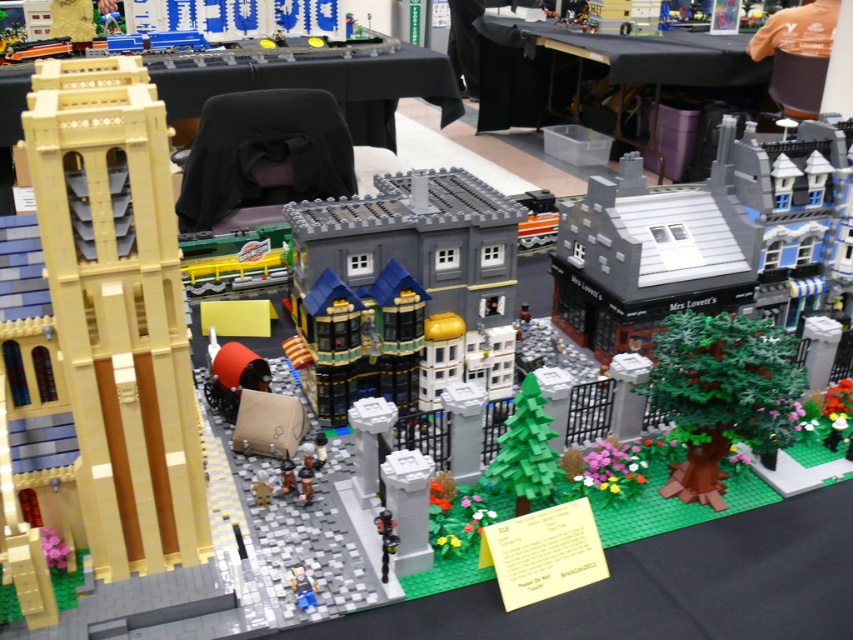
Question: Which point appears farthest from the camera in this image?

Choices:
 (A) (521, 384)
 (B) (633, 115)

Answer: (B)

Question: Which point is closer to the camera?

Choices:
 (A) pyautogui.click(x=553, y=458)
 (B) pyautogui.click(x=587, y=122)

Answer: (A)

Question: Is black plastic table at upper center below black fabric table at upper center?

Choices:
 (A) yes
 (B) no

Answer: (B)

Question: Which object is closer to the camera taking this photo?

Choices:
 (A) green matte tree at center
 (B) black fabric table at upper center
 (C) black plastic table at upper center
 (D) shiny black figure at center

Answer: (D)

Question: Does black plastic table at upper center have a greater width compared to shiny black figure at center?

Choices:
 (A) yes
 (B) no

Answer: (A)

Question: Is the position of green matte tree at center more distant than that of smooth plastic figure at center?

Choices:
 (A) no
 (B) yes

Answer: (B)